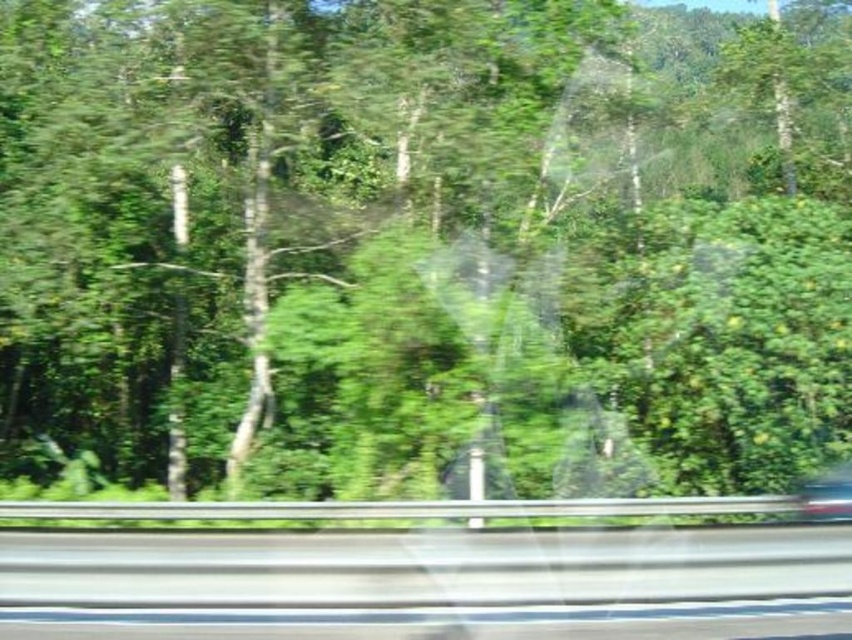
Question: Does smooth asphalt highway at center have a greater width compared to metallic silver car at lower right?

Choices:
 (A) yes
 (B) no

Answer: (A)

Question: Which point is closer to the camera?

Choices:
 (A) metallic silver car at lower right
 (B) smooth asphalt highway at center

Answer: (B)

Question: Can you confirm if smooth asphalt highway at center is positioned to the right of metallic silver car at lower right?

Choices:
 (A) no
 (B) yes

Answer: (A)

Question: Which point is farther to the camera?

Choices:
 (A) metallic silver car at lower right
 (B) smooth asphalt highway at center

Answer: (A)

Question: In this image, where is smooth asphalt highway at center located relative to metallic silver car at lower right?

Choices:
 (A) below
 (B) above

Answer: (B)